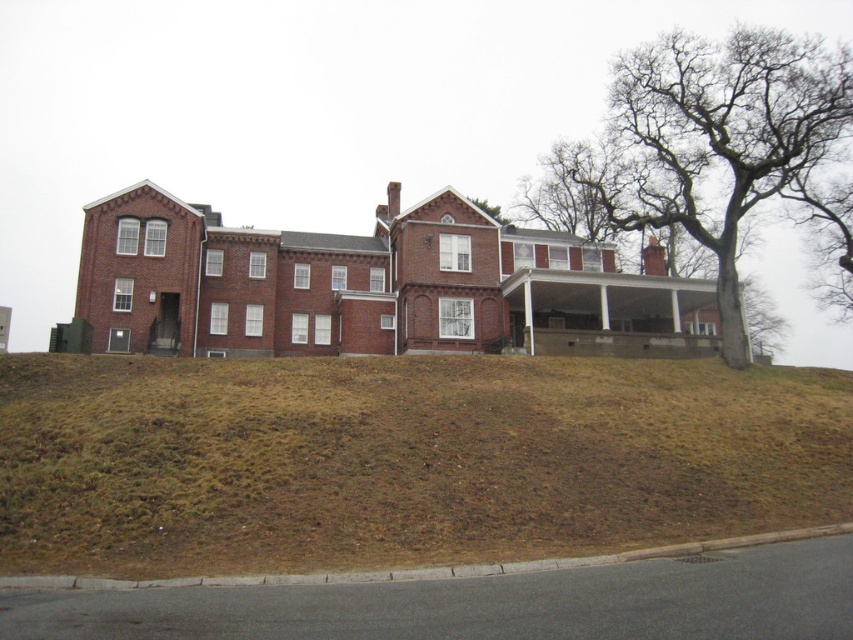
Can you confirm if brown grass at lower center is bigger than bare branches at upper right?

No.

Which is more to the right, brown grass at lower center or bare branches at upper right?

bare branches at upper right is more to the right.

Does point (556, 364) come farther from viewer compared to point (717, 124)?

No, it is in front of (717, 124).

At what (x,y) coordinates should I click in order to perform the action: click on brown grass at lower center. Please return your answer as a coordinate pair (x, y). Looking at the image, I should click on (402, 460).